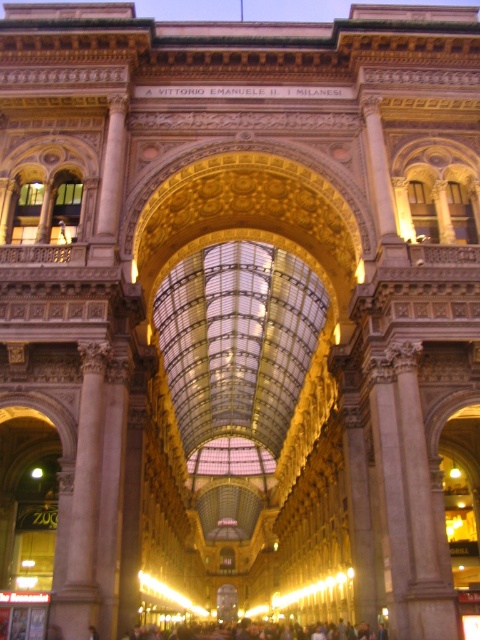
From the picture: You are standing in the Galleria Vittorio Emanuele II and notice the white marble column at left and the dark gray concrete crowd at lower center. Which object is positioned higher from the ground?

The white marble column at left is located above the dark gray concrete crowd at lower center, so it is positioned higher from the ground.

You are an architect designing a new column for the Galleria Vittorio Emanuele II. You want to ensure the new column has the same width as the existing white marble column at left. Given that the dark gray concrete crowd at lower center is wider than the column, can you estimate the maximum width your new column should be to fit within the space allocated for it?

The white marble column at left has a width less than the dark gray concrete crowd at lower center. Therefore, the new column should be designed to be narrower than the dark gray concrete crowd at lower center to match the existing column width.